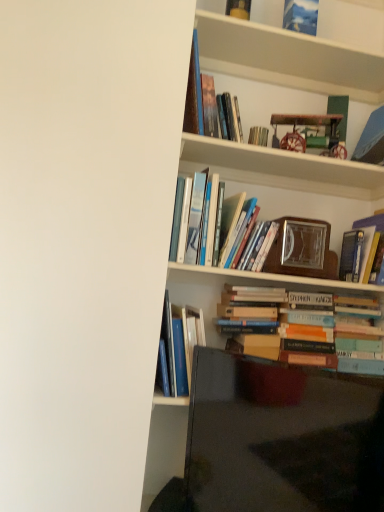
You are a GUI agent. You are given a task and a screenshot of the screen. Output one action in this format:
    pyautogui.click(x=<x>, y=<y>)
    Task: Click on the free space that is to the left of metallic silver book at upper center, the sixth book in the bottom-to-top sequence
    The height and width of the screenshot is (512, 384).
    Given the screenshot: What is the action you would take?
    pyautogui.click(x=216, y=150)